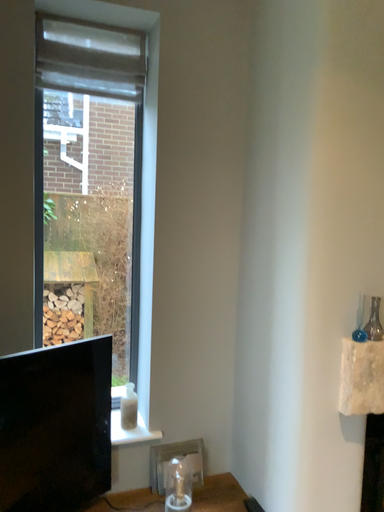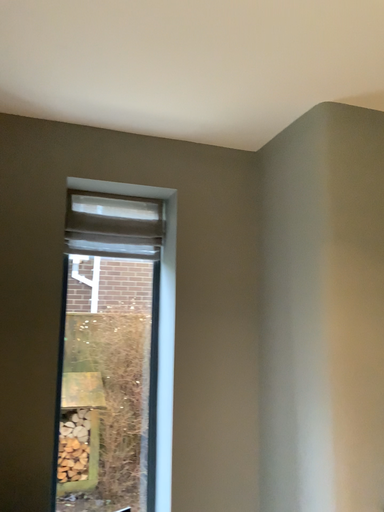
Question: How did the camera likely rotate when shooting the video?

Choices:
 (A) rotated upward
 (B) rotated downward

Answer: (A)